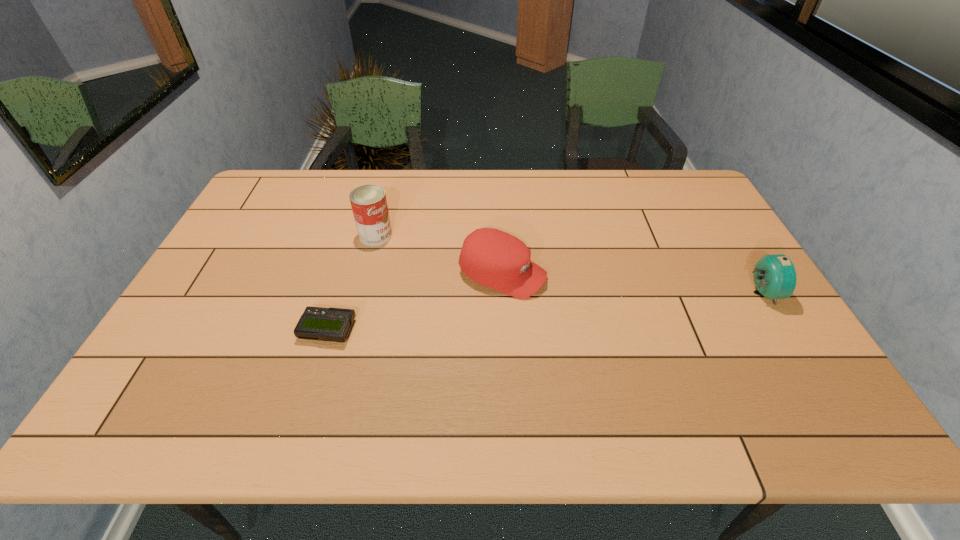
This screenshot has height=540, width=960. Identify the location of vacant spot on the desktop that is between the nearest object and the alarm clock and is positioned on the front label of the tallest object. (540, 312).

Locate an element on the screen. The width and height of the screenshot is (960, 540). free spot on the desktop that is between the nearest object and the rightmost object and is positioned on the front-facing side of the third object from left to right is located at coordinates (603, 306).